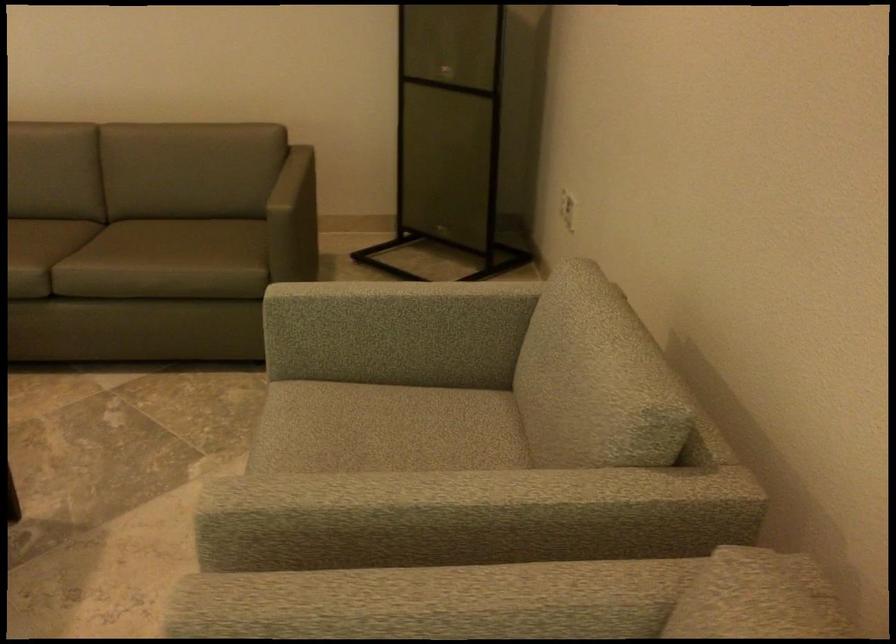
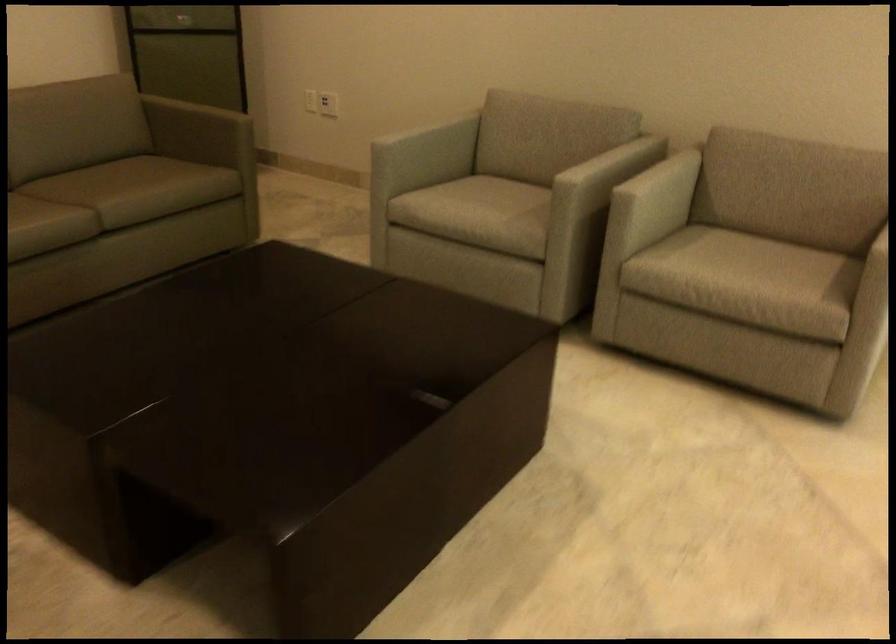
Find the pixel in the second image that matches point 418,301 in the first image.

(423, 127)